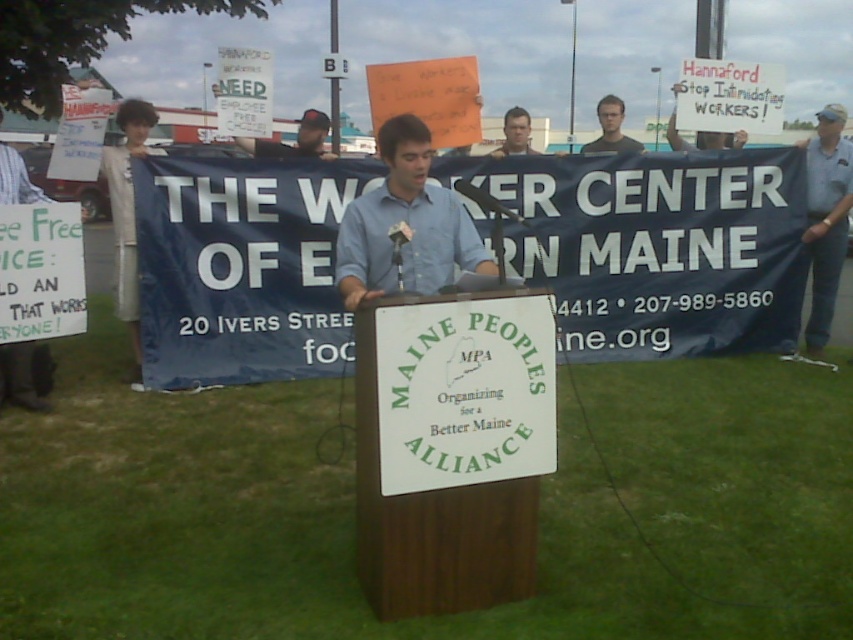
Question: Which point is closer to the camera?

Choices:
 (A) (422, 189)
 (B) (670, 129)
 (C) (611, 145)
 (D) (811, 326)

Answer: (A)

Question: Is blue denim jeans at right above matte cardboard sign at upper center?

Choices:
 (A) no
 (B) yes

Answer: (A)

Question: Which point is closer to the camera taking this photo?

Choices:
 (A) (386, 150)
 (B) (622, 147)
 (C) (526, 122)

Answer: (A)

Question: Which object is the farthest from the matte black shirt at center?

Choices:
 (A) blue shirt at center
 (B) dark blue shirt at center
 (C) smooth skin face at center

Answer: (A)

Question: Is blue denim jeans at right further to camera compared to matte cardboard sign at upper center?

Choices:
 (A) no
 (B) yes

Answer: (A)

Question: Is blue denim jeans at right closer to camera compared to dark blue shirt at center?

Choices:
 (A) yes
 (B) no

Answer: (B)